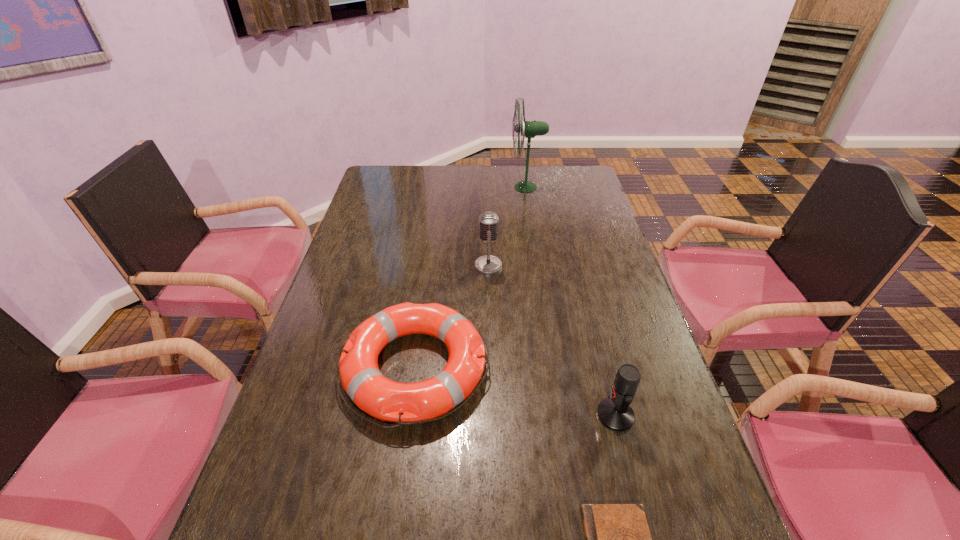
Find the location of a particular element. The height and width of the screenshot is (540, 960). free spot located on the right of the farther microphone is located at coordinates (569, 266).

The image size is (960, 540). Identify the location of free spot located 0.130m on the side of the shorter microphone with the red ring. (540, 415).

I want to click on vacant space situated on the side of the shorter microphone with the red ring, so click(464, 415).

Where is `free space located on the side of the shorter microphone with the red ring`? The width and height of the screenshot is (960, 540). free space located on the side of the shorter microphone with the red ring is located at coordinates (504, 415).

Identify the location of vacant space positioned on the right of the fourth tallest object. This screenshot has height=540, width=960. (554, 368).

What are the coordinates of `object present at the far edge` in the screenshot? It's located at (529, 129).

You are a GUI agent. You are given a task and a screenshot of the screen. Output one action in this format:
    pyautogui.click(x=<x>, y=<y>)
    Task: Click on the object that is at the left edge
    The height and width of the screenshot is (540, 960).
    Given the screenshot: What is the action you would take?
    pyautogui.click(x=405, y=403)

Where is `object at the right edge`? object at the right edge is located at coordinates (614, 412).

Locate an element on the screen. free location at the far edge of the desktop is located at coordinates (521, 172).

Locate an element on the screen. vacant space at the left edge of the desktop is located at coordinates (370, 207).